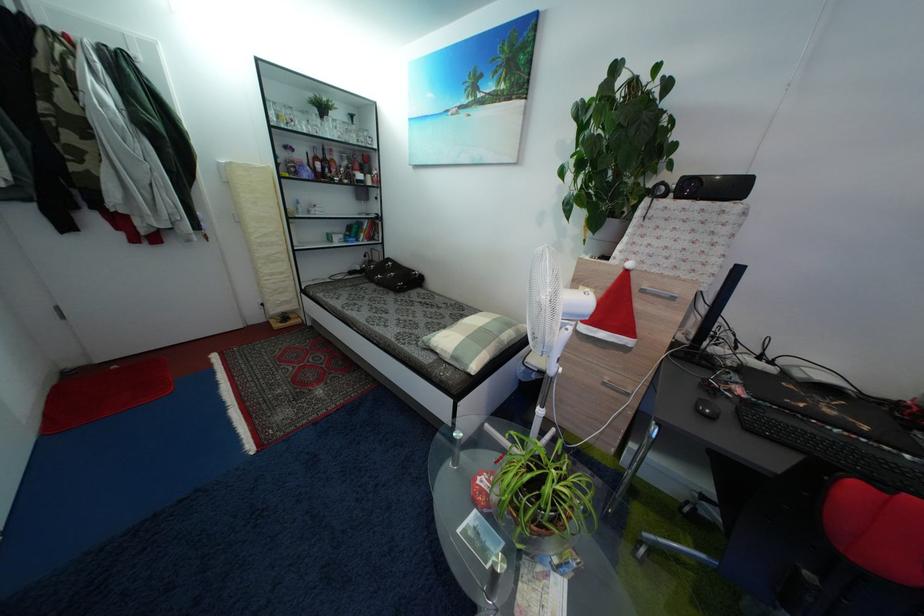
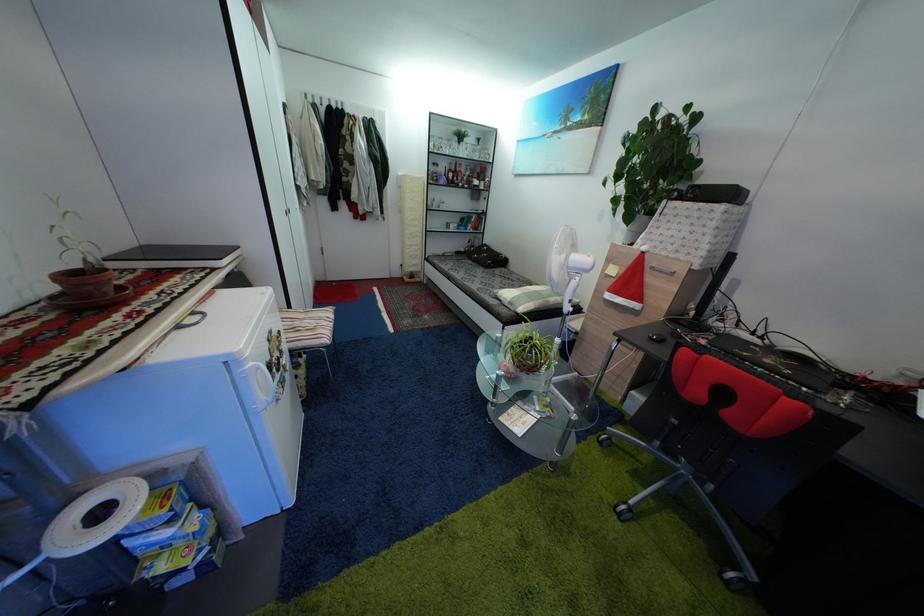
In the second image, find the point that corresponds to the point at 462,363 in the first image.

(517, 310)